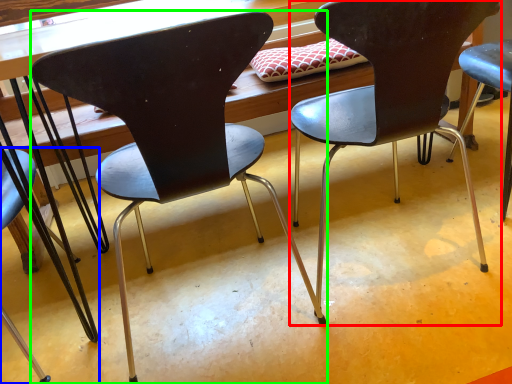
Question: Which is farther away from chair (highlighted by a red box)? chair (highlighted by a blue box) or chair (highlighted by a green box)?

Choices:
 (A) chair
 (B) chair

Answer: (A)